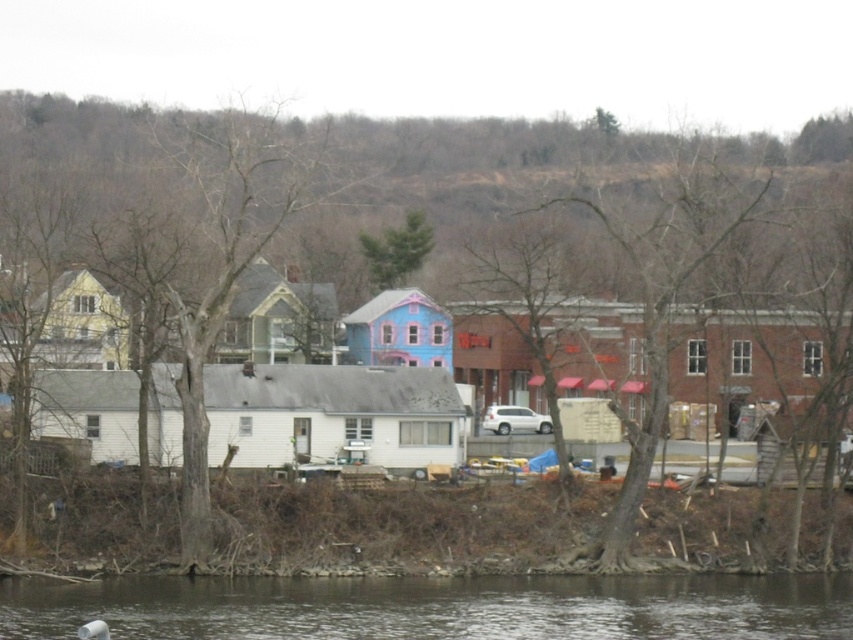
You are a bird looking for a place to perch. You see a bare wood tree at center and a green matte tree at upper center. Which tree would you choose if you prefer a larger tree to rest on?

The bare wood tree at center is larger in size than the green matte tree at upper center, so you should choose the bare wood tree at center to rest on.

You are standing at the point closest to the shoreline in the image. Which of the two points, point 1 at coordinates (193,422) or point 2 at coordinates (401,276), is closer to you?

Point 1 at coordinates (193,422) is closer to you because it is in front of point 2 at coordinates (401,276).

You are an architect designing a new treehouse. You have two options for trees to build it on in the scene described. The trees are the bare branches at center and the brown bark tree at left. Which tree would you choose if you want the treehouse to be higher above the ground?

The bare branches at center is much taller than the brown bark tree at left, so building the treehouse on the bare branches at center would place it higher above the ground.